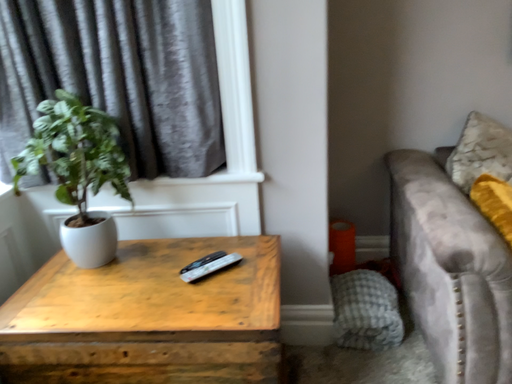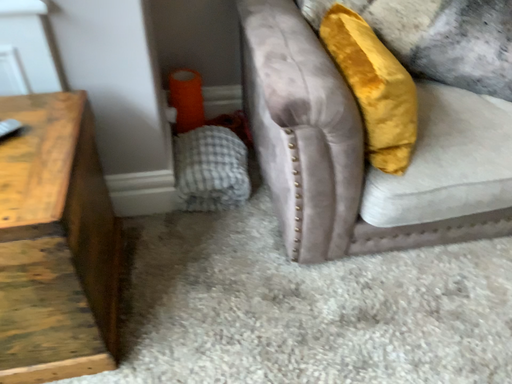
Question: How did the camera likely rotate when shooting the video?

Choices:
 (A) rotated upward
 (B) rotated downward

Answer: (B)